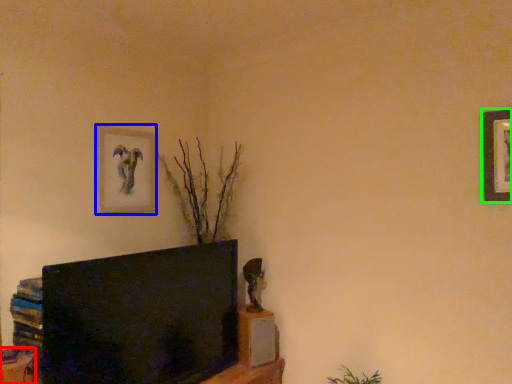
Question: Which object is the farthest from furniture (highlighted by a red box)? Choose among these: picture frame (highlighted by a blue box) or picture frame (highlighted by a green box).

Choices:
 (A) picture frame
 (B) picture frame

Answer: (B)